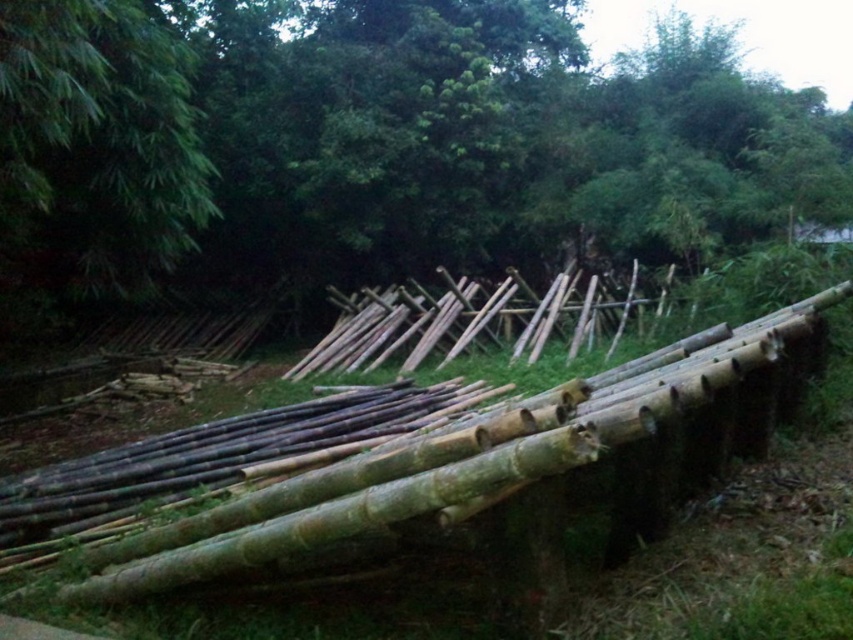
Is natural bamboo at center behind green bamboo logs at center?

Yes.

How far apart are natural bamboo at center and green bamboo logs at center?

natural bamboo at center is 6.60 meters away from green bamboo logs at center.

Is point (151, 198) positioned behind point (635, 420)?

Yes, it is behind point (635, 420).

The height and width of the screenshot is (640, 853). In order to click on natural bamboo at center in this screenshot , I will do (374, 147).

The image size is (853, 640). In order to click on green bamboo logs at center in this screenshot , I will do `click(486, 465)`.

Where is `green bamboo logs at center`? Image resolution: width=853 pixels, height=640 pixels. green bamboo logs at center is located at coordinates (486, 465).

Which is above, natural bamboo at center or green bamboo at upper left?

natural bamboo at center is above.

Is natural bamboo at center bigger than green bamboo at upper left?

Indeed, natural bamboo at center has a larger size compared to green bamboo at upper left.

Which is in front, point (90, 68) or point (155, 138)?

Point (90, 68)

Find the location of a particular element. natural bamboo at center is located at coordinates (374, 147).